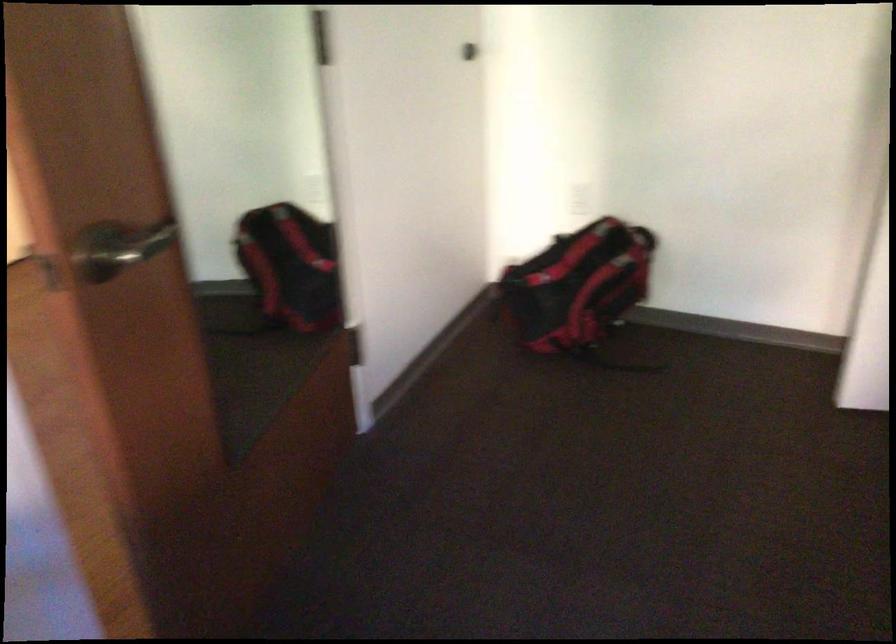
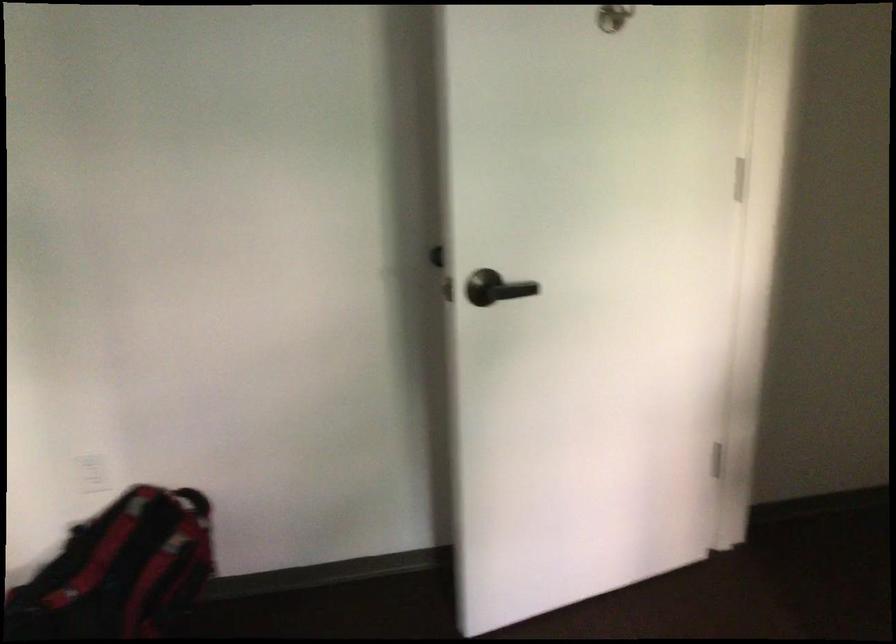
Find the pixel in the second image that matches (x=576, y=267) in the first image.

(119, 570)